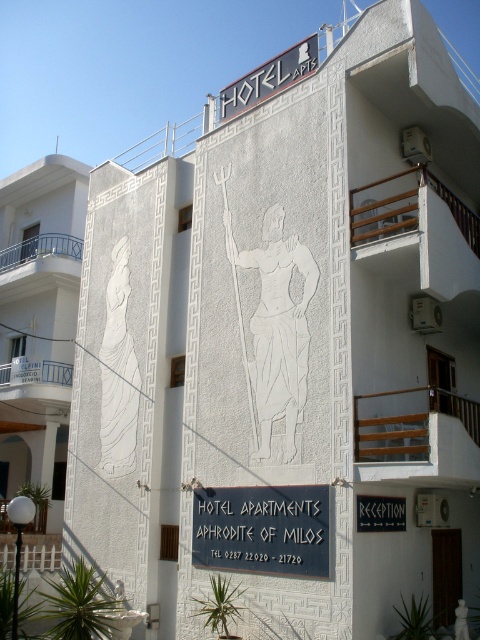
Question: Which object appears farthest from the camera in this image?

Choices:
 (A) black matte sign at center
 (B) black metal signboard at center

Answer: (B)

Question: Does white plastic sign at upper center have a larger size compared to black matte sign at center?

Choices:
 (A) yes
 (B) no

Answer: (A)

Question: Does white plastic sign at upper center appear on the left side of black matte sign at center?

Choices:
 (A) yes
 (B) no

Answer: (A)

Question: Which object is the closest to the black matte sign at center?

Choices:
 (A) black metal signboard at center
 (B) white plastic sign at upper center

Answer: (A)

Question: Is white plastic sign at upper center wider than black matte sign at center?

Choices:
 (A) no
 (B) yes

Answer: (B)

Question: Which object appears closest to the camera in this image?

Choices:
 (A) black metal signboard at center
 (B) black matte sign at center

Answer: (B)